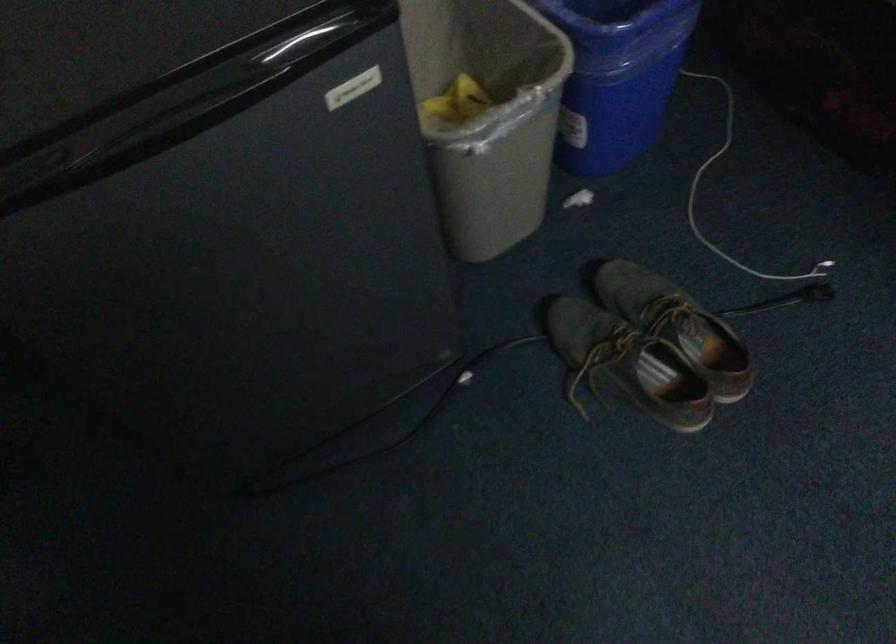
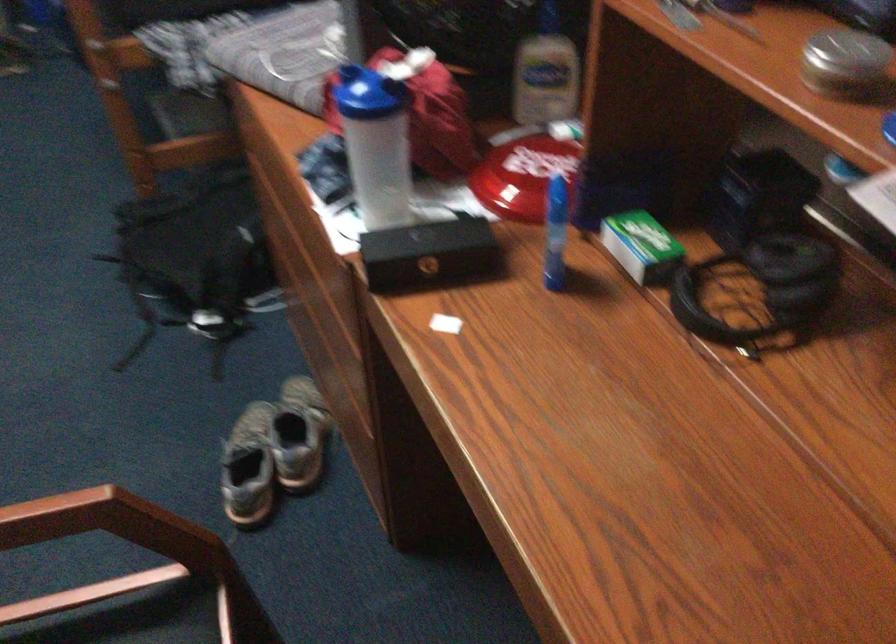
Which direction would the cameraman need to move to produce the second image?

The cameraman moved toward right, backward.